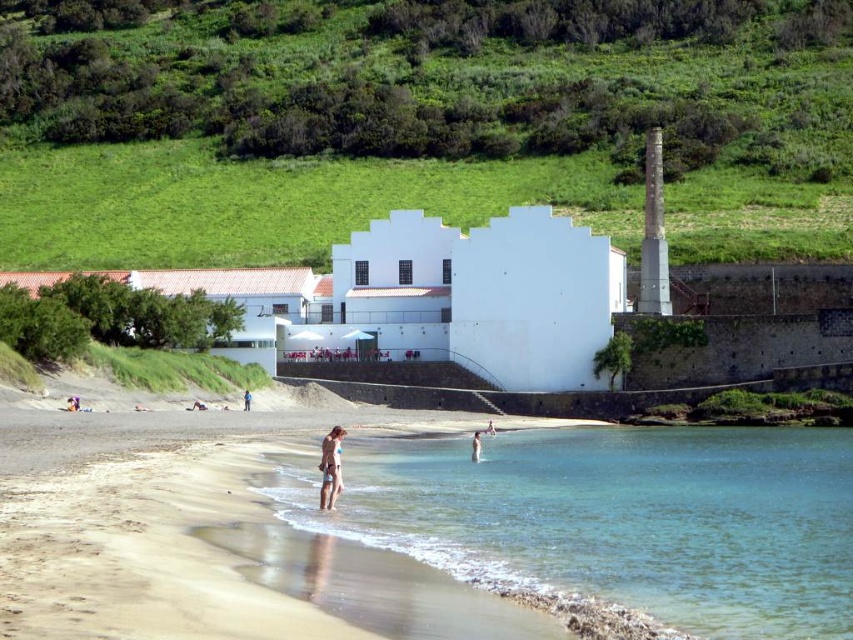
You are a lifeguard standing on a tower overlooking the beach. You notice a swimmer in the clear water at beach center and a person under a blue fabric at center. If the swimmer starts moving directly towards the blue fabric person at center, will they have to swim more than 30 meters?

→ The distance between the clear water at beach center and blue fabric person at center is 34.48 meters, so yes, the swimmer will have to swim more than 30 meters to reach them.

You are a tourist standing at the edge of the beach. You see the green grass at upper center and the clear water at beach center. Which one is located to the left when facing the beach?

The green grass at upper center is positioned on the left side of clear water at beach center, so when facing the beach, the green grass at upper center is to the left of the clear water at beach center.